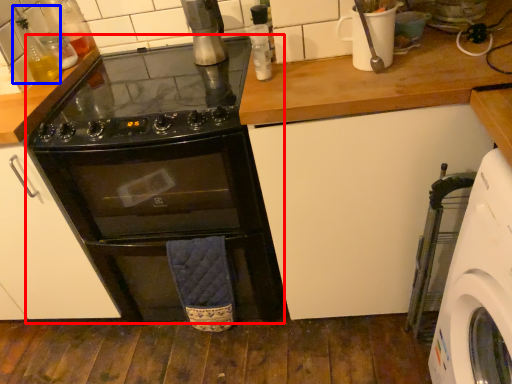
Question: Which object appears farthest to the camera in this image, oven (highlighted by a red box) or bottle (highlighted by a blue box)?

Choices:
 (A) oven
 (B) bottle

Answer: (B)